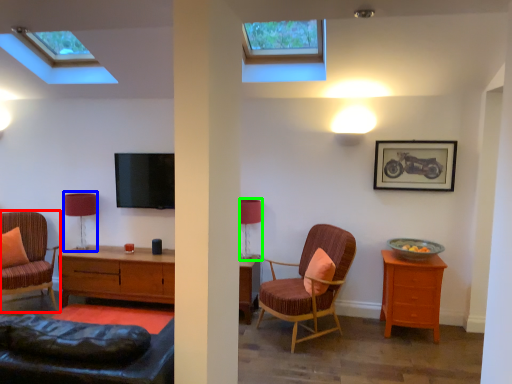
Question: Estimate the real-world distances between objects in this image. Which object is closer to chair (highlighted by a red box), table lamp (highlighted by a blue box) or table lamp (highlighted by a green box)?

Choices:
 (A) table lamp
 (B) table lamp

Answer: (A)